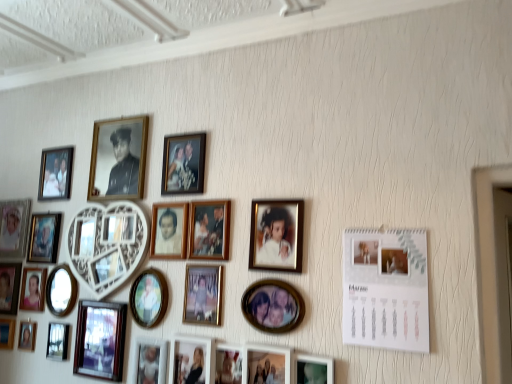
Question: Does matte gold picture frame at center, arranged as the 13th picture frame when viewed from the right, contain gold metallic photo frame at center, placed as the 4th picture frame when sorted from right to left?

Choices:
 (A) yes
 (B) no

Answer: (B)

Question: From a real-world perspective, is matte gold picture frame at center, which appears as the thirteenth picture frame when viewed from the left, located beneath gold metallic photo frame at center, placed as the 4th picture frame when sorted from right to left?

Choices:
 (A) yes
 (B) no

Answer: (A)

Question: Does matte gold picture frame at center, arranged as the 13th picture frame when viewed from the right, have a lesser height compared to gold metallic photo frame at center, which is counted as the 22th picture frame, starting from the left?

Choices:
 (A) no
 (B) yes

Answer: (A)

Question: Is matte gold picture frame at center, arranged as the 13th picture frame when viewed from the right, outside gold metallic photo frame at center, which is counted as the 22th picture frame, starting from the left?

Choices:
 (A) yes
 (B) no

Answer: (A)

Question: Is matte gold picture frame at center, which appears as the thirteenth picture frame when viewed from the left, beside gold metallic photo frame at center, placed as the 4th picture frame when sorted from right to left?

Choices:
 (A) no
 (B) yes

Answer: (A)

Question: From their relative heights in the image, would you say matte gold picture frame at center, which is the 23th picture frame from left to right, is taller or shorter than metallic gold photo frame at center, which is the eighteenth picture frame from left to right?

Choices:
 (A) tall
 (B) short

Answer: (A)

Question: In the image, is matte gold picture frame at center, the 3th picture frame from the right, positioned in front of or behind metallic gold photo frame at center, which ranks as the eighth picture frame in right-to-left order?

Choices:
 (A) front
 (B) behind

Answer: (A)

Question: From a real-world perspective, is matte gold picture frame at center, which is the 23th picture frame from left to right, above or below metallic gold photo frame at center, which ranks as the eighth picture frame in right-to-left order?

Choices:
 (A) above
 (B) below

Answer: (A)

Question: From the image's perspective, is matte gold picture frame at center, the 3th picture frame from the right, located above or below metallic gold photo frame at center, which ranks as the eighth picture frame in right-to-left order?

Choices:
 (A) above
 (B) below

Answer: (A)

Question: Considering the positions of metallic gold picture frame at upper left, the 12th picture frame viewed from the left, and matte black photo frame at lower right, which appears as the 2th picture frame when viewed from the right, in the image, is metallic gold picture frame at upper left, the 12th picture frame viewed from the left, wider or thinner than matte black photo frame at lower right, which appears as the 2th picture frame when viewed from the right,?

Choices:
 (A) wide
 (B) thin

Answer: (A)

Question: Does point (143, 122) appear closer or farther from the camera than point (303, 374)?

Choices:
 (A) closer
 (B) farther

Answer: (B)

Question: In the image, is metallic gold picture frame at upper left, the 12th picture frame viewed from the left, on the left side or the right side of matte black photo frame at lower right, the 24th picture frame positioned from the left?

Choices:
 (A) left
 (B) right

Answer: (A)

Question: From a real-world perspective, is metallic gold picture frame at upper left, the 12th picture frame viewed from the left, physically located above or below matte black photo frame at lower right, the 24th picture frame positioned from the left?

Choices:
 (A) above
 (B) below

Answer: (A)

Question: In terms of size, does matte black photo frame at lower right, the 24th picture frame positioned from the left, appear bigger or smaller than matte black picture frame at lower left, which is the 10th picture frame from left to right?

Choices:
 (A) small
 (B) big

Answer: (A)

Question: Is matte black photo frame at lower right, which appears as the 2th picture frame when viewed from the right, to the left or to the right of matte black picture frame at lower left, arranged as the 16th picture frame when viewed from the right, in the image?

Choices:
 (A) right
 (B) left

Answer: (A)